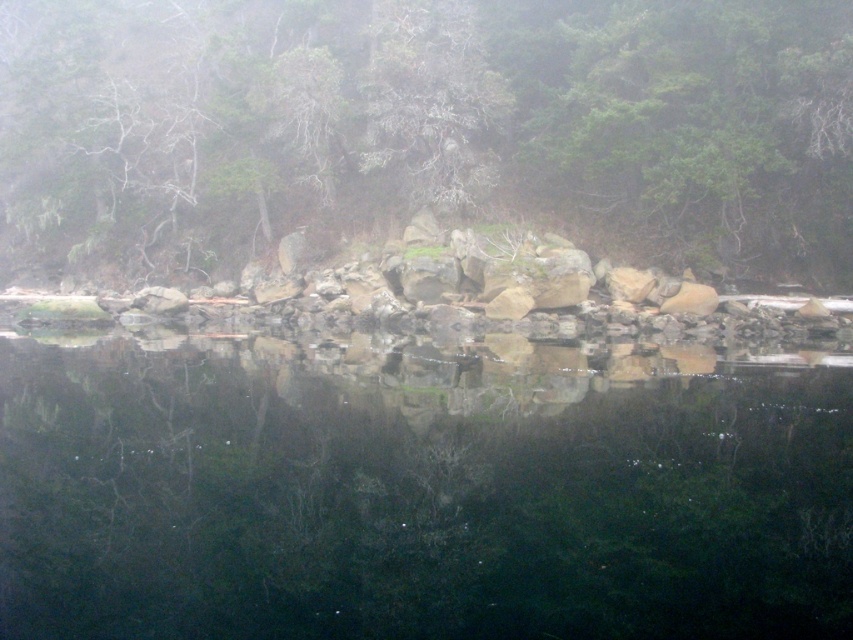
You are a bird flying over the serene natural scene. You see the transparent water at center and the green matte tree at center. Which object is located below the other?

The transparent water at center is positioned under the green matte tree at center, so the water is below the tree.

You are a photographer trying to capture the reflection of the transparent water at center and the green matte tree at center in the image. Which object will appear narrower in the reflection?

The transparent water at center will appear narrower in the reflection because it is thinner than the green matte tree at center.